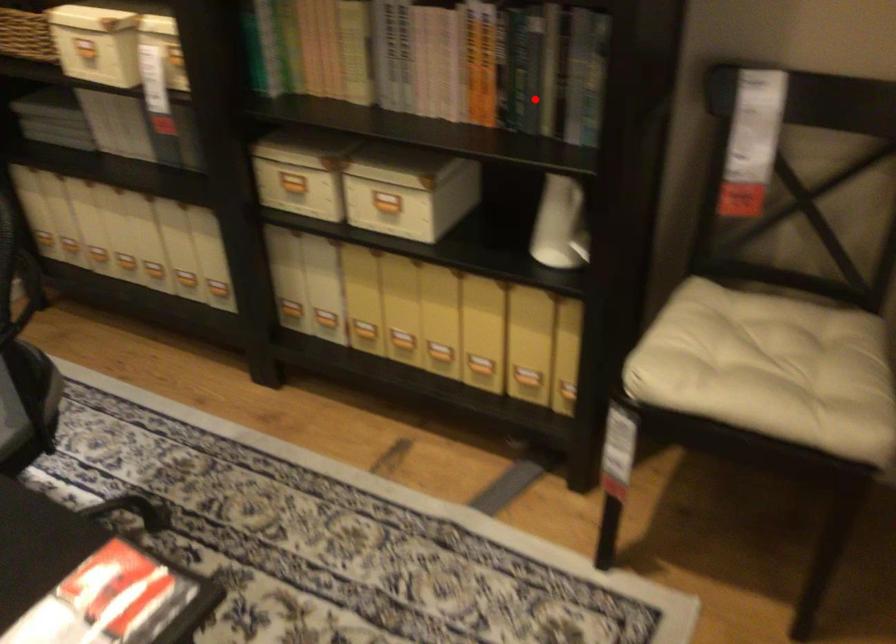
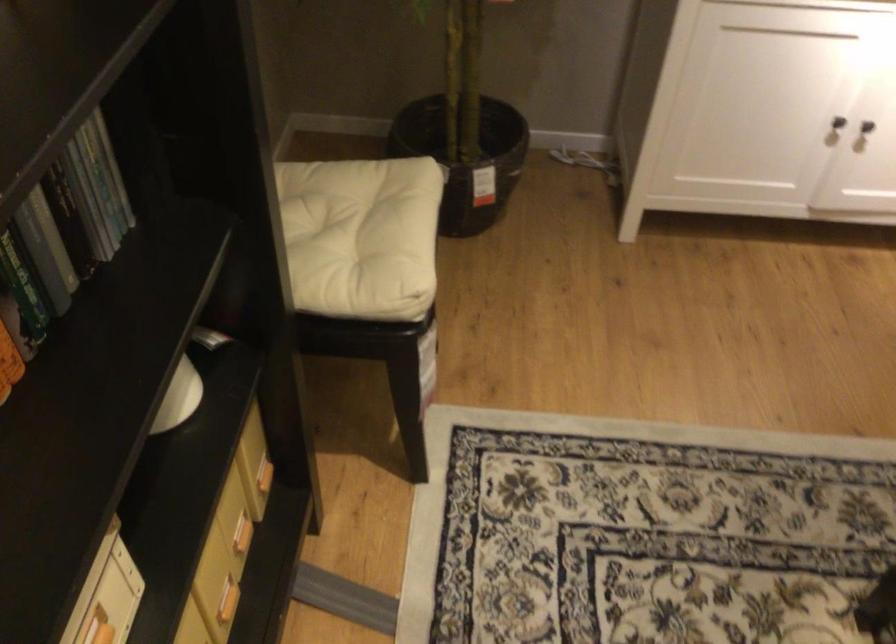
Question: I am providing you with two images of the same scene from different viewpoints. Given a red point in image1, look at the same physical point in image2. Is it:

Choices:
 (A) Closer to the viewpoint
 (B) Farther from the viewpoint

Answer: (A)